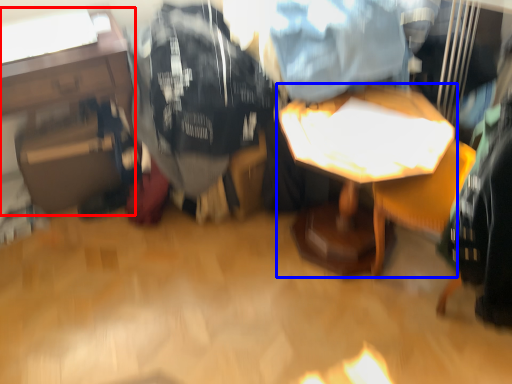
Question: Which of the following is the closest to the observer, table (highlighted by a red box) or table (highlighted by a blue box)?

Choices:
 (A) table
 (B) table

Answer: (B)